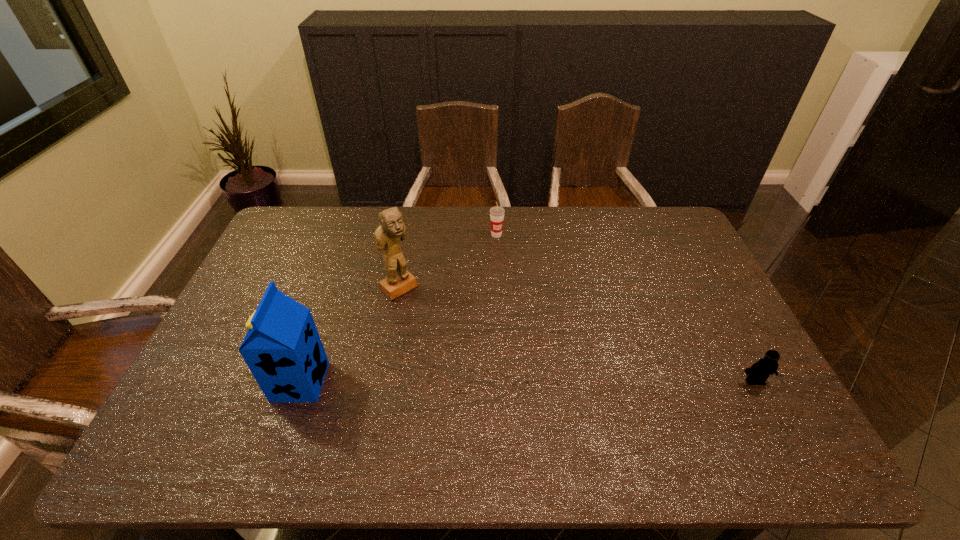
At what (x,y) coordinates should I click in order to perform the action: click on empty location between the third nearest object and the third object from left to right. Please return your answer as a coordinate pair (x, y). This screenshot has width=960, height=540. Looking at the image, I should click on (447, 261).

Where is `blank region between the Lego and the second shortest object`? The image size is (960, 540). blank region between the Lego and the second shortest object is located at coordinates (626, 308).

Find the location of a particular element. unoccupied position between the shortest object and the leftmost object is located at coordinates (527, 381).

I want to click on free point between the carton and the shortest object, so click(x=527, y=381).

Locate an element on the screen. This screenshot has height=540, width=960. vacant space in between the shortest object and the third nearest object is located at coordinates (577, 335).

Image resolution: width=960 pixels, height=540 pixels. Identify the location of vacant area between the second farthest object and the carton. (349, 335).

The height and width of the screenshot is (540, 960). In order to click on object that is the second closest one to the third tallest object in this screenshot , I will do point(282,348).

Identify which object is the second closest to the leftmost object. Please provide its 2D coordinates. Your answer should be formatted as a tuple, i.e. [(x, y)], where the tuple contains the x and y coordinates of a point satisfying the conditions above.

[(496, 213)]